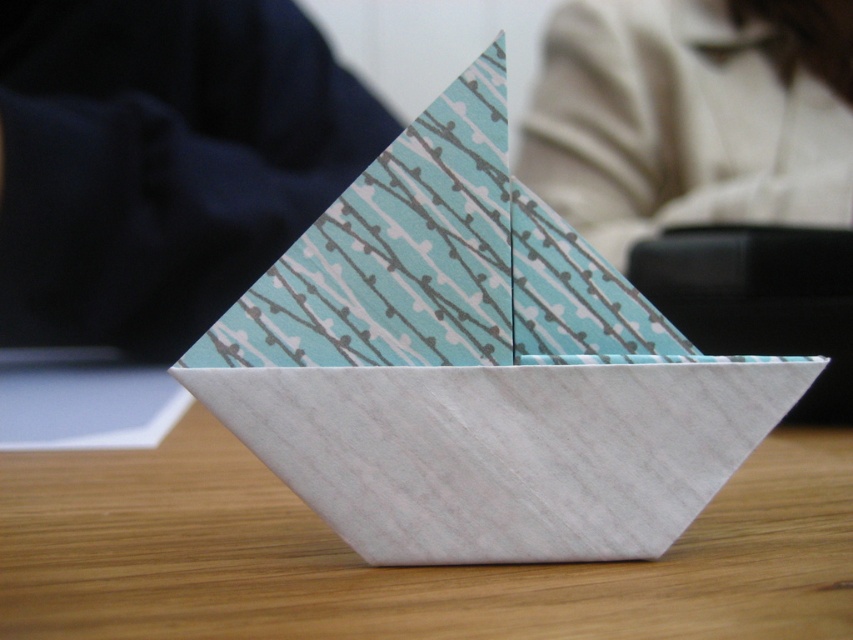
Which is more to the right, white textured paper boat at center or white fabric at upper center?

white fabric at upper center is more to the right.

Is the position of white textured paper boat at center more distant than that of white fabric at upper center?

No, it is in front of white fabric at upper center.

This screenshot has width=853, height=640. Identify the location of white textured paper boat at center. (477, 365).

In the scene shown: Can you confirm if white textured paper boat at center is smaller than navy blue fabric at left?

Yes, white textured paper boat at center is smaller than navy blue fabric at left.

Who is higher up, white textured paper boat at center or navy blue fabric at left?

navy blue fabric at left

I want to click on white textured paper boat at center, so click(477, 365).

Can you confirm if white paper boat at center is positioned to the right of navy blue fabric at left?

Yes, white paper boat at center is to the right of navy blue fabric at left.

Is white paper boat at center above navy blue fabric at left?

Incorrect, white paper boat at center is not positioned above navy blue fabric at left.

This screenshot has height=640, width=853. I want to click on white paper boat at center, so click(396, 566).